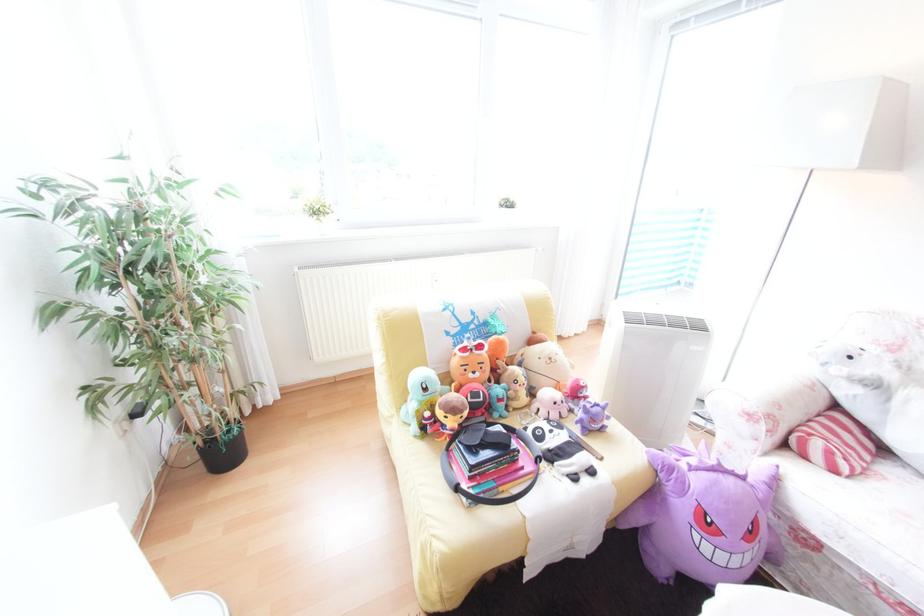
The location [469,368] corresponds to which object?

This point indicates the orange Ryan plush.